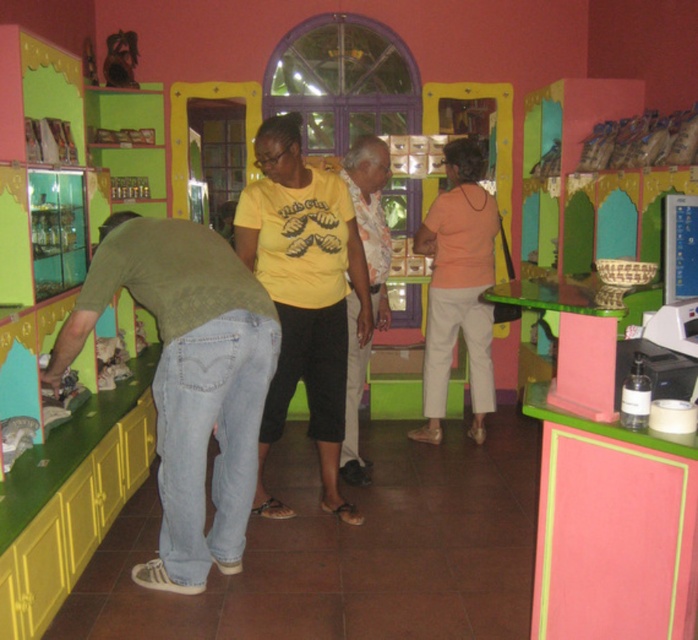
Which is behind, point (311, 301) or point (371, 157)?

The point (371, 157) is behind.

Who is positioned more to the left, yellow matte t-shirt at center or white fabric shirt at center?

yellow matte t-shirt at center

Is point (290, 172) farther from viewer compared to point (380, 307)?

No, it is not.

This screenshot has height=640, width=698. Identify the location of yellow matte t-shirt at center. (304, 296).

Describe the element at coordinates (304, 296) in the screenshot. I see `yellow matte t-shirt at center` at that location.

Measure the distance between yellow matte t-shirt at center and matte peach blouse at center.

1.13 meters

Is point (269, 156) closer to viewer compared to point (431, 252)?

Yes.

Where is `yellow matte t-shirt at center`? yellow matte t-shirt at center is located at coordinates (304, 296).

Which is in front, point (450, 323) or point (349, 356)?

Point (349, 356) is in front.

Is matte peach blouse at center to the left of white fabric shirt at center from the viewer's perspective?

No, matte peach blouse at center is not to the left of white fabric shirt at center.

You are a GUI agent. You are given a task and a screenshot of the screen. Output one action in this format:
    pyautogui.click(x=<x>, y=<y>)
    Task: Click on the matte peach blouse at center
    The height and width of the screenshot is (640, 698).
    Given the screenshot: What is the action you would take?
    pyautogui.click(x=459, y=289)

Identify the location of matte peach blouse at center. Image resolution: width=698 pixels, height=640 pixels. (459, 289).